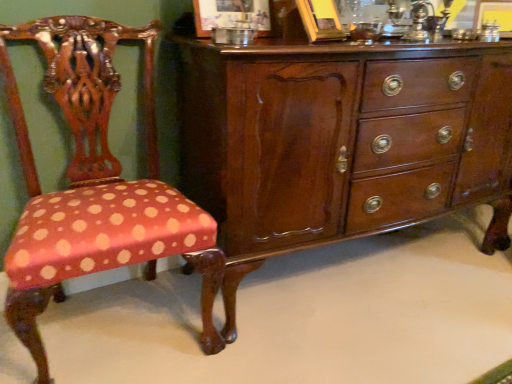
At what (x,y) coordinates should I click in order to perform the action: click on free spot below mahogany wood chest of drawers at center (from a real-world perspective). Please return your answer as a coordinate pair (x, y). The width and height of the screenshot is (512, 384). Looking at the image, I should click on (340, 274).